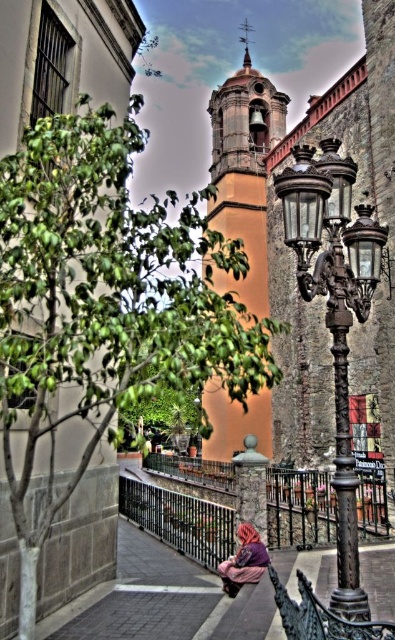
Question: Among these points, which one is farthest from the camera?

Choices:
 (A) (331, 170)
 (B) (176, 477)

Answer: (B)

Question: Among these points, which one is nearest to the camera?

Choices:
 (A) (218, 472)
 (B) (242, 540)

Answer: (B)

Question: Is orange stucco bell tower at center above purple fabric at lower center?

Choices:
 (A) no
 (B) yes

Answer: (B)

Question: Does green leafy tree at upper left appear on the right side of bronze textured streetlamp at center right?

Choices:
 (A) yes
 (B) no

Answer: (B)

Question: Estimate the real-world distances between objects in this image. Which object is closer to the bronze textured streetlamp at center right?

Choices:
 (A) purple fabric at lower center
 (B) orange stucco bell tower at center

Answer: (A)

Question: Can you confirm if green leafy tree at upper left is positioned to the left of black wrought iron railing at center?

Choices:
 (A) yes
 (B) no

Answer: (A)